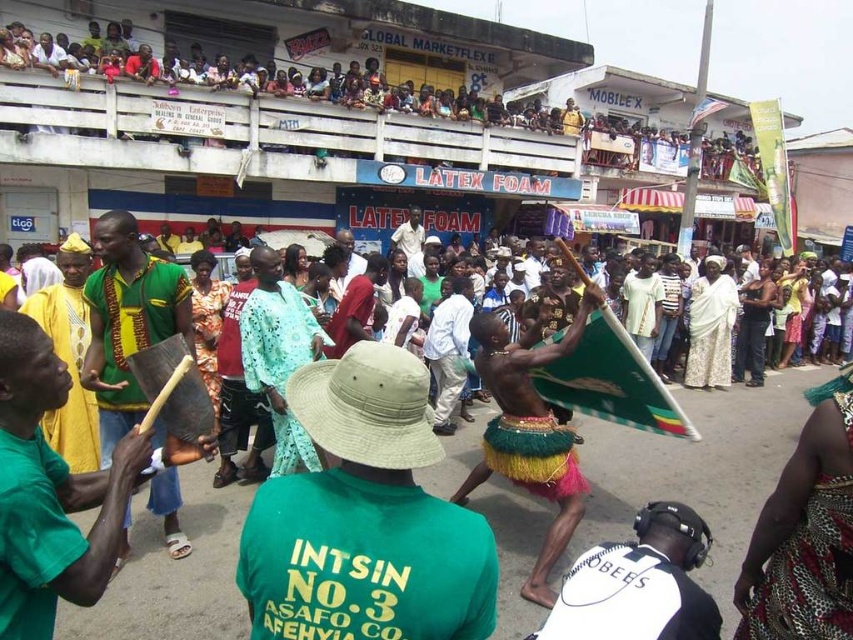
Does multicolored fabric crowd at upper center have a smaller size compared to white matte shirt at lower right?

Actually, multicolored fabric crowd at upper center might be larger than white matte shirt at lower right.

Does multicolored fabric crowd at upper center appear on the right side of white matte shirt at lower right?

Yes, multicolored fabric crowd at upper center is to the right of white matte shirt at lower right.

Where is `multicolored fabric crowd at upper center`? multicolored fabric crowd at upper center is located at coordinates (343, 93).

Can you confirm if green woven cloth at left is positioned to the right of white matte shirt at lower right?

Incorrect, green woven cloth at left is not on the right side of white matte shirt at lower right.

Which is more to the right, green woven cloth at left or white matte shirt at lower right?

From the viewer's perspective, white matte shirt at lower right appears more on the right side.

Between point (154, 337) and point (563, 595), which one is positioned behind?

Positioned behind is point (154, 337).

You are a GUI agent. You are given a task and a screenshot of the screen. Output one action in this format:
    pyautogui.click(x=<x>, y=<y>)
    Task: Click on the green woven cloth at left
    
    Given the screenshot: What is the action you would take?
    pyautogui.click(x=126, y=321)

Can you confirm if multicolored fabric crowd at upper center is shorter than green woven cloth at left?

No.

How far apart are multicolored fabric crowd at upper center and green woven cloth at left?

A distance of 14.57 meters exists between multicolored fabric crowd at upper center and green woven cloth at left.

Locate an element on the screen. multicolored fabric crowd at upper center is located at coordinates (343, 93).